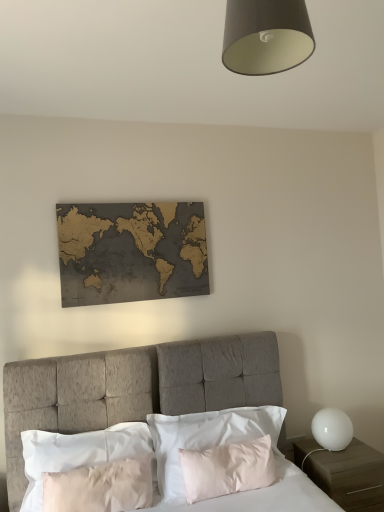
Question: Is white matte globe at right not near textured gray headboard at center?

Choices:
 (A) yes
 (B) no

Answer: (B)

Question: From a real-world perspective, is white matte globe at right under textured gray headboard at center?

Choices:
 (A) no
 (B) yes

Answer: (A)

Question: Considering the relative positions of white matte globe at right and textured gray headboard at center in the image provided, is white matte globe at right to the left of textured gray headboard at center from the viewer's perspective?

Choices:
 (A) no
 (B) yes

Answer: (A)

Question: Considering the relative sizes of white matte globe at right and textured gray headboard at center in the image provided, is white matte globe at right wider than textured gray headboard at center?

Choices:
 (A) no
 (B) yes

Answer: (A)

Question: Could you tell me if white matte globe at right is turned towards textured gray headboard at center?

Choices:
 (A) yes
 (B) no

Answer: (B)

Question: Does white matte globe at right have a larger size compared to textured gray headboard at center?

Choices:
 (A) no
 (B) yes

Answer: (A)

Question: Considering the relative sizes of white matte nightstand at lower right and silky white pillow at center, placed as the second pillow when sorted from left to right, in the image provided, is white matte nightstand at lower right shorter than silky white pillow at center, placed as the second pillow when sorted from left to right,?

Choices:
 (A) no
 (B) yes

Answer: (A)

Question: Is white matte nightstand at lower right positioned with its back to silky white pillow at center, the 1th pillow positioned from the right?

Choices:
 (A) yes
 (B) no

Answer: (B)

Question: Can you confirm if white matte nightstand at lower right is positioned to the right of silky white pillow at center, placed as the second pillow when sorted from left to right?

Choices:
 (A) no
 (B) yes

Answer: (B)

Question: Does white matte nightstand at lower right contain silky white pillow at center, placed as the second pillow when sorted from left to right?

Choices:
 (A) no
 (B) yes

Answer: (A)

Question: Can you confirm if white matte nightstand at lower right is taller than silky white pillow at center, placed as the second pillow when sorted from left to right?

Choices:
 (A) no
 (B) yes

Answer: (B)

Question: Is white matte nightstand at lower right positioned far away from silky white pillow at center, placed as the second pillow when sorted from left to right?

Choices:
 (A) no
 (B) yes

Answer: (A)

Question: Is gold-toned wood world map at upper center shorter than pale pink satin pillow at center, placed as the second pillow when sorted from right to left?

Choices:
 (A) no
 (B) yes

Answer: (A)